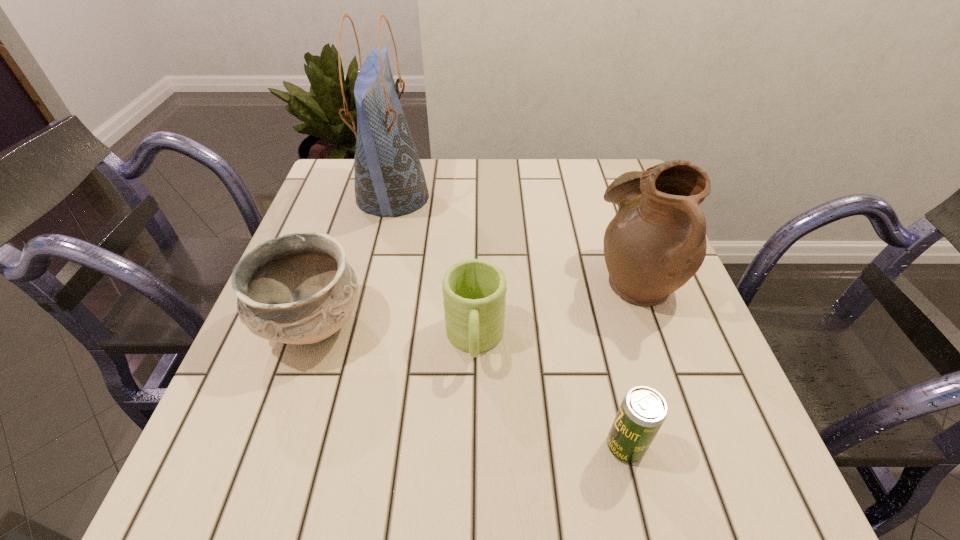
Identify the location of vacant space situated 0.070m on the back of the pottery. (334, 264).

Where is `free region located 0.140m on the side of the mug with the handle`? free region located 0.140m on the side of the mug with the handle is located at coordinates (473, 457).

I want to click on free region located on the left of the nearest object, so click(568, 447).

Image resolution: width=960 pixels, height=540 pixels. Find the location of `object present at the far edge`. object present at the far edge is located at coordinates (389, 180).

The height and width of the screenshot is (540, 960). What are the coordinates of `object that is at the near edge` in the screenshot? It's located at (643, 410).

Identify the location of shopping bag present at the left edge. The width and height of the screenshot is (960, 540). (389, 180).

Find the location of a particular element. The image size is (960, 540). pottery at the left edge is located at coordinates (298, 288).

The width and height of the screenshot is (960, 540). Find the location of `object that is at the right edge`. object that is at the right edge is located at coordinates (656, 242).

Identify the location of object located in the far left corner section of the desktop. The width and height of the screenshot is (960, 540). (389, 180).

This screenshot has width=960, height=540. I want to click on vacant space at the far edge of the desktop, so click(525, 173).